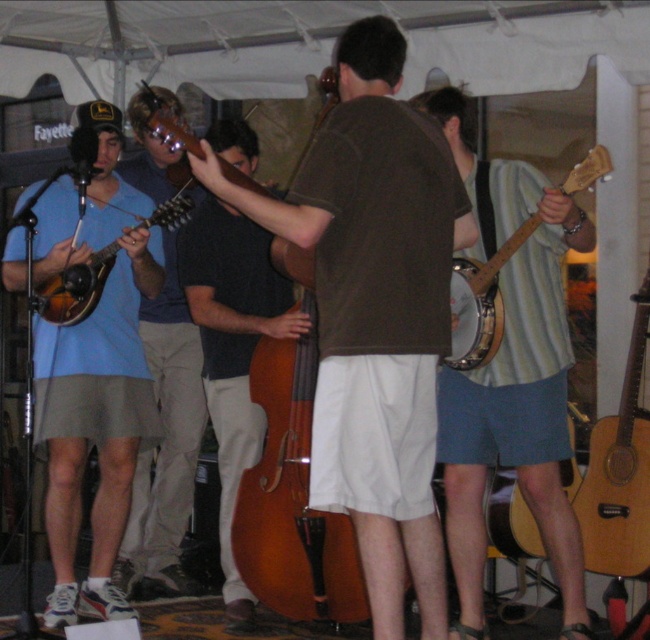
Question: Which of the following is the closest to the observer?

Choices:
 (A) brown wooden cello at center
 (B) matte brown banjo at left
 (C) acoustic wood guitar at right

Answer: (A)

Question: Does acoustic wood guitar at right appear under wooden mandolin at left?

Choices:
 (A) no
 (B) yes

Answer: (B)

Question: Which object is closer to the camera taking this photo?

Choices:
 (A) wooden banjo at center-right
 (B) wooden mandolin at left
 (C) acoustic wood guitar at right

Answer: (A)

Question: Considering the real-world distances, which object is farthest from the brown wooden cello at center?

Choices:
 (A) acoustic wood guitar at right
 (B) wooden acoustic guitar at lower right
 (C) wooden mandolin at left
 (D) brown matte cello at center

Answer: (A)

Question: Is wooden banjo at center-right to the left of wooden acoustic guitar at lower right from the viewer's perspective?

Choices:
 (A) yes
 (B) no

Answer: (A)

Question: In this image, where is matte brown banjo at left located relative to wooden acoustic guitar at lower right?

Choices:
 (A) left
 (B) right

Answer: (A)